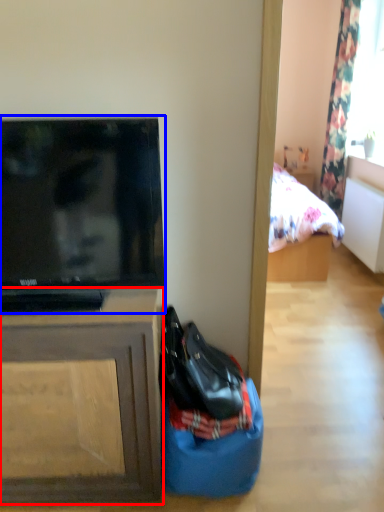
Question: Which point is closer to the camera, cabinetry (highlighted by a red box) or television (highlighted by a blue box)?

Choices:
 (A) cabinetry
 (B) television

Answer: (B)